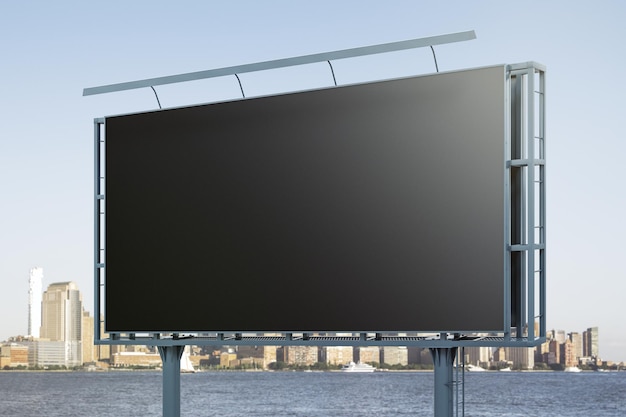
At what (x,y) coordinates should I click in order to perform the action: click on screen. Please return your answer as a coordinate pair (x, y). The image size is (626, 417). Looking at the image, I should click on (292, 213).